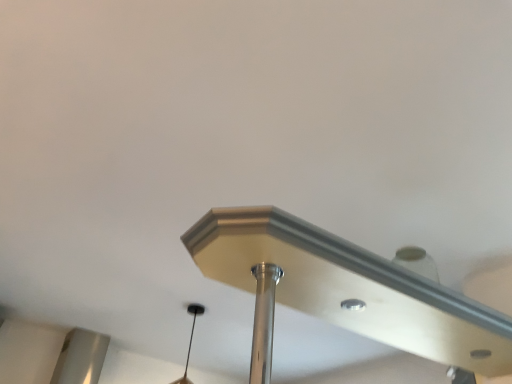
Image resolution: width=512 pixels, height=384 pixels. What are the coordinates of `metallic silver lamp at center` in the screenshot? It's located at (351, 287).

This screenshot has height=384, width=512. What do you see at coordinates (351, 287) in the screenshot? I see `metallic silver lamp at center` at bounding box center [351, 287].

The height and width of the screenshot is (384, 512). In order to click on metallic silver lamp at center in this screenshot , I will do `click(351, 287)`.